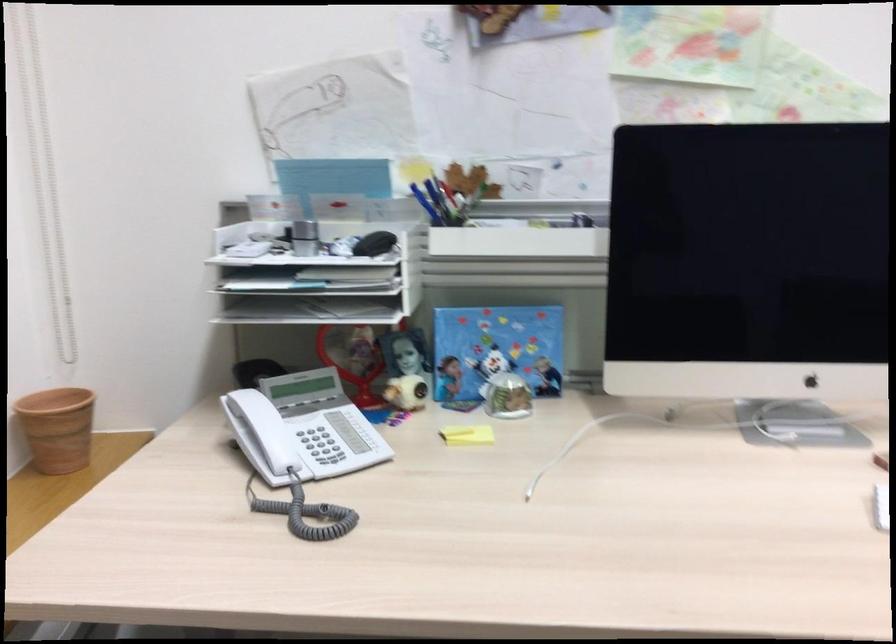
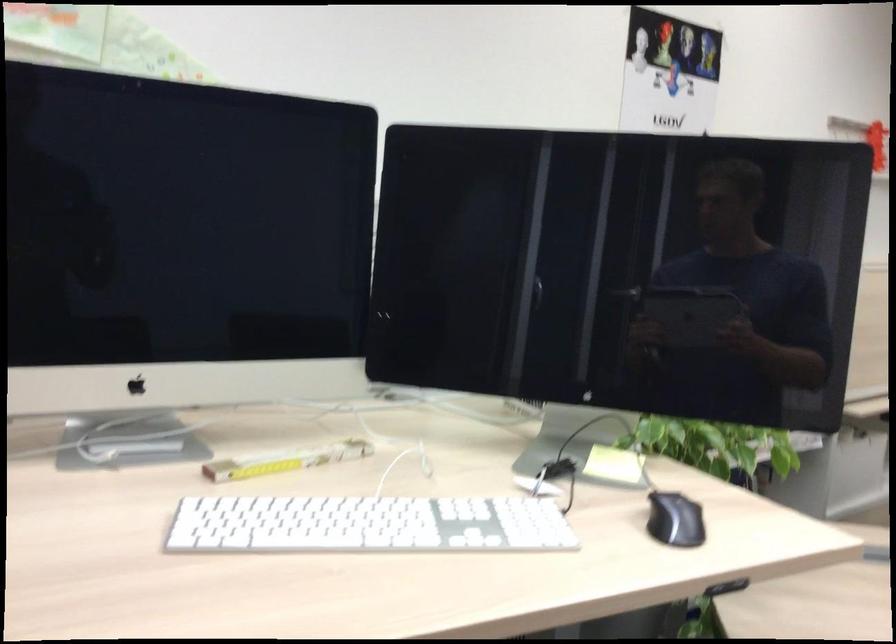
Question: The camera is either moving clockwise (left) or counter-clockwise (right) around the object. The first image is from the beginning of the video and the second image is from the end. Is the camera moving left or right when shooting the video?

Choices:
 (A) Left
 (B) Right

Answer: (A)